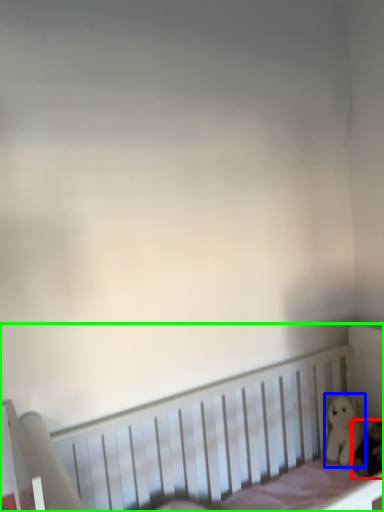
Question: Which object is positioned farthest from toy (highlighted by a red box)? Select from toy (highlighted by a blue box) and infant bed (highlighted by a green box).

Choices:
 (A) toy
 (B) infant bed

Answer: (B)